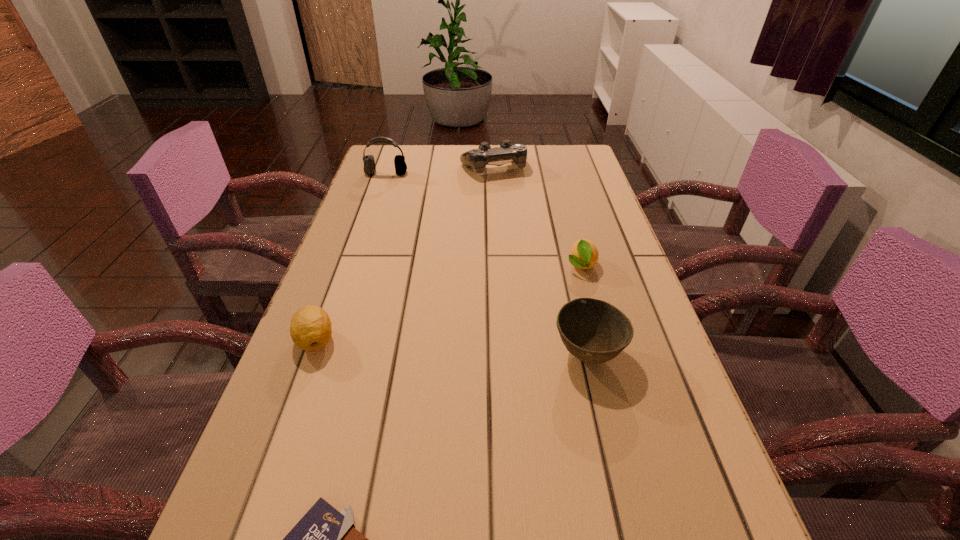
This screenshot has height=540, width=960. Identify the location of headset. (369, 168).

Image resolution: width=960 pixels, height=540 pixels. In order to click on control in this screenshot , I will do `click(478, 158)`.

Locate an element on the screen. Image resolution: width=960 pixels, height=540 pixels. bowl is located at coordinates (594, 331).

Where is `the nearer lemon`? The image size is (960, 540). the nearer lemon is located at coordinates (310, 329).

The image size is (960, 540). I want to click on the farther lemon, so click(x=584, y=254).

Identify the location of the right lemon. The height and width of the screenshot is (540, 960). (584, 254).

I want to click on free location located on the headband of the tallest object, so click(x=359, y=253).

At what (x,y) coordinates should I click in order to perform the action: click on vacant point located on the front of the control. Please return your answer as a coordinate pair (x, y). Image resolution: width=960 pixels, height=540 pixels. Looking at the image, I should click on (496, 239).

Identify the location of free point located 0.200m on the left of the bowl. coord(450,354).

Where is `vacant space located 0.240m at the stem end of the left lemon`? The height and width of the screenshot is (540, 960). vacant space located 0.240m at the stem end of the left lemon is located at coordinates click(262, 487).